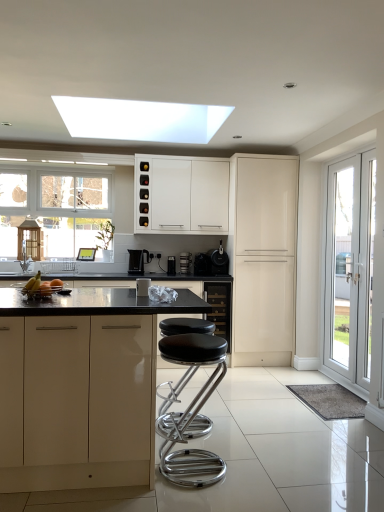
This screenshot has width=384, height=512. What do you see at coordinates (41, 286) in the screenshot? I see `yellow matte bananas at center` at bounding box center [41, 286].

This screenshot has width=384, height=512. Describe the element at coordinates (192, 412) in the screenshot. I see `polished chrome stool at center` at that location.

What do you see at coordinates (219, 308) in the screenshot?
I see `black matte wine cooler at center, marked as the third cabinetry in a back-to-front arrangement` at bounding box center [219, 308].

You are a GUI agent. You are given a task and a screenshot of the screen. Output one action in this format:
    pyautogui.click(x=<x>, y=<y>)
    Task: Click on the black matte wine cooler at center, positioned as the second cabinetry in front-to-back order
    
    Given the screenshot: What is the action you would take?
    pyautogui.click(x=219, y=308)

The image size is (384, 512). What are the coordinates of `white glossy cabinet at upper center, the first cabinetry in the back-to-front sequence` in the screenshot? It's located at (181, 195).

Describe the element at coordinates (138, 261) in the screenshot. I see `black plastic kettle at center` at that location.

In the scene shown: What is the approximate width of white glossy door at right, positioned as the 1th door in front-to-back order?

The width of white glossy door at right, positioned as the 1th door in front-to-back order, is 1.08 inches.

I want to click on yellow matte bananas at center, so click(x=41, y=286).

From a real-world perspective, is wooden door at left, the first door viewed from the back, positioned above or below matte cream cabinet at center, placed as the 1th cabinetry when sorted from front to back?

From a real-world perspective, wooden door at left, the first door viewed from the back, is physically above matte cream cabinet at center, placed as the 1th cabinetry when sorted from front to back.

Is wooden door at left, the 2th door viewed from the right, oriented away from matte cream cabinet at center, the 4th cabinetry in the back-to-front sequence?

No, matte cream cabinet at center, the 4th cabinetry in the back-to-front sequence, is not at the back of wooden door at left, the 2th door viewed from the right.

I want to click on the 3rd cabinetry positioned below the wooden door at left, the first door viewed from the back (from a real-world perspective), so click(x=81, y=405).

Is wooden door at left, the first door viewed from the back, completely or partially outside of matte cream cabinet at center, the 4th cabinetry in the back-to-front sequence?

wooden door at left, the first door viewed from the back, is positioned outside matte cream cabinet at center, the 4th cabinetry in the back-to-front sequence.

Considering the sizes of objects black matte coffee maker at center, which ranks as the fourth appliance in back-to-front order, and white glossy door at right, which is the second door in back-to-front order, in the image provided, who is bigger, black matte coffee maker at center, which ranks as the fourth appliance in back-to-front order, or white glossy door at right, which is the second door in back-to-front order,?

white glossy door at right, which is the second door in back-to-front order.

From the image's perspective, would you say black matte coffee maker at center, which is counted as the 2th appliance, starting from the front, is shown under white glossy door at right, positioned as the 1th door in front-to-back order?

No.

Relative to white glossy door at right, positioned as the 1th door in front-to-back order, is black matte coffee maker at center, the first appliance from the right, in front or behind?

In the image, black matte coffee maker at center, the first appliance from the right, appears behind white glossy door at right, positioned as the 1th door in front-to-back order.

Is black matte coffee maker at center, the first appliance from the right, not close to white glossy door at right, positioned as the 1th door in front-to-back order?

black matte coffee maker at center, the first appliance from the right, is far away from white glossy door at right, positioned as the 1th door in front-to-back order.

What are the coordinates of `door below the matte cream cabinet at center-right, which is the third cabinetry from front to back (from the image's perspective)` in the screenshot? It's located at coord(350,268).

Which of these two, white glossy door at right, which ranks as the 1th door in right-to-left order, or matte cream cabinet at center-right, which is the third cabinetry from front to back, stands taller?

With more height is matte cream cabinet at center-right, which is the third cabinetry from front to back.

In the scene shown: Is white glossy door at right, positioned as the 1th door in front-to-back order, completely or partially outside of matte cream cabinet at center-right, which is the third cabinetry from front to back?

white glossy door at right, positioned as the 1th door in front-to-back order, is positioned outside matte cream cabinet at center-right, which is the third cabinetry from front to back.

Considering the positions of objects black matte coffee maker at center, which ranks as the fourth appliance in back-to-front order, and black matte wine cooler at center, positioned as the second cabinetry in front-to-back order, in the image provided, who is more to the left, black matte coffee maker at center, which ranks as the fourth appliance in back-to-front order, or black matte wine cooler at center, positioned as the second cabinetry in front-to-back order,?

Positioned to the left is black matte wine cooler at center, positioned as the second cabinetry in front-to-back order.

From the image's perspective, is black matte coffee maker at center, the first appliance from the right, beneath black matte wine cooler at center, positioned as the second cabinetry in front-to-back order?

Actually, black matte coffee maker at center, the first appliance from the right, appears above black matte wine cooler at center, positioned as the second cabinetry in front-to-back order, in the image.

Are metallic silver coffee machine at center, which ranks as the 1th appliance in left-to-right order, and satin black coffee machine at center, the third appliance from the back, far apart?

Yes, metallic silver coffee machine at center, which ranks as the 1th appliance in left-to-right order, and satin black coffee machine at center, the third appliance from the back, are quite far apart.

From the image's perspective, does metallic silver coffee machine at center, which ranks as the 1th appliance in left-to-right order, appear lower than satin black coffee machine at center, the third appliance positioned from the front?

Correct, metallic silver coffee machine at center, which ranks as the 1th appliance in left-to-right order, appears lower than satin black coffee machine at center, the third appliance positioned from the front, in the image.

Do you think metallic silver coffee machine at center, acting as the 1th appliance starting from the front, is within satin black coffee machine at center, the third appliance from the back, or outside of it?

metallic silver coffee machine at center, acting as the 1th appliance starting from the front, is outside satin black coffee machine at center, the third appliance from the back.

In terms of size, does metallic silver coffee machine at center, which ranks as the 1th appliance in left-to-right order, appear bigger or smaller than satin black coffee machine at center, acting as the 4th appliance starting from the left?

In the image, metallic silver coffee machine at center, which ranks as the 1th appliance in left-to-right order, appears to be smaller than satin black coffee machine at center, acting as the 4th appliance starting from the left.

Considering the relative positions of matte cream cabinet at center, the 4th cabinetry in the back-to-front sequence, and black matte coffee maker at center, which ranks as the fourth appliance in back-to-front order, in the image provided, is matte cream cabinet at center, the 4th cabinetry in the back-to-front sequence, to the left of black matte coffee maker at center, which ranks as the fourth appliance in back-to-front order, from the viewer's perspective?

Yes, matte cream cabinet at center, the 4th cabinetry in the back-to-front sequence, is to the left of black matte coffee maker at center, which ranks as the fourth appliance in back-to-front order.

From the picture: From the image's perspective, is matte cream cabinet at center, the 4th cabinetry in the back-to-front sequence, positioned above or below black matte coffee maker at center, which is counted as the 2th appliance, starting from the front?

Clearly, from the image's perspective, matte cream cabinet at center, the 4th cabinetry in the back-to-front sequence, is below black matte coffee maker at center, which is counted as the 2th appliance, starting from the front.

Who is smaller, matte cream cabinet at center, the 4th cabinetry in the back-to-front sequence, or black matte coffee maker at center, which ranks as the fourth appliance in back-to-front order?

With smaller size is black matte coffee maker at center, which ranks as the fourth appliance in back-to-front order.

You are a GUI agent. You are given a task and a screenshot of the screen. Output one action in this format:
    pyautogui.click(x=<x>, y=<y>)
    Task: Click on the 5th appliance positioned above the matte cream cabinet at center, the 4th cabinetry in the back-to-front sequence (from the image's perspective)
    The image size is (384, 512).
    Given the screenshot: What is the action you would take?
    pyautogui.click(x=211, y=263)

Can you confirm if white glossy door at right, which ranks as the 1th door in right-to-left order, is smaller than satin black toaster at center, which is the 5th appliance in front-to-back order?

No, white glossy door at right, which ranks as the 1th door in right-to-left order, is not smaller than satin black toaster at center, which is the 5th appliance in front-to-back order.

Could you tell me if white glossy door at right, positioned as the 1th door in front-to-back order, is turned towards satin black toaster at center, the 1th appliance from the back?

No, white glossy door at right, positioned as the 1th door in front-to-back order, is not oriented towards satin black toaster at center, the 1th appliance from the back.

Is white glossy door at right, which is the second door in back-to-front order, completely or partially outside of satin black toaster at center, the 1th appliance from the back?

Yes, white glossy door at right, which is the second door in back-to-front order, is not within satin black toaster at center, the 1th appliance from the back.

There is a matte cream cabinet at center, placed as the 1th cabinetry when sorted from front to back. Where is `the 2nd door above it (from a real-world perspective)`? the 2nd door above it (from a real-world perspective) is located at coordinates (29, 242).

The height and width of the screenshot is (512, 384). I want to click on door on the right of black matte coffee maker at center, which ranks as the fourth appliance in back-to-front order, so click(350, 268).

Based on their spatial positions, is matte cream cabinet at center-right, which is the third cabinetry from front to back, or polished chrome stool at center closer to wooden door at left, the 2th door viewed from the right?

Based on the image, matte cream cabinet at center-right, which is the third cabinetry from front to back, appears to be nearer to wooden door at left, the 2th door viewed from the right.

Consider the image. Looking at the image, which one is located closer to matte cream cabinet at center, placed as the 1th cabinetry when sorted from front to back, satin black coffee machine at center, the 2th appliance in the right-to-left sequence, or matte cream cabinet at center-right, which is the third cabinetry from front to back?

Based on the image, matte cream cabinet at center-right, which is the third cabinetry from front to back, appears to be nearer to matte cream cabinet at center, placed as the 1th cabinetry when sorted from front to back.

From the image, which object appears to be nearer to white glossy door at right, which is the second door in back-to-front order, black matte wine cooler at center, positioned as the second cabinetry in front-to-back order, or black plastic coffee maker at center, the second appliance when ordered from left to right?

The object closer to white glossy door at right, which is the second door in back-to-front order, is black matte wine cooler at center, positioned as the second cabinetry in front-to-back order.

From the image, which object appears to be nearer to black plastic kettle at center, wooden door at left, the 2th door viewed from the right, or matte cream cabinet at center, the 4th cabinetry in the back-to-front sequence?

wooden door at left, the 2th door viewed from the right, lies closer to black plastic kettle at center than the other object.

Based on their spatial positions, is satin black toaster at center, which is counted as the 3th appliance, starting from the left, or white glossy door at right, which is the second door in back-to-front order, further from polished chrome stool at center?

Based on the image, satin black toaster at center, which is counted as the 3th appliance, starting from the left, appears to be further to polished chrome stool at center.

Estimate the real-world distances between objects in this image. Which object is further from satin black toaster at center, the 1th appliance from the back, matte cream cabinet at center-right, which is counted as the second cabinetry, starting from the back, or matte cream cabinet at center, the 4th cabinetry in the back-to-front sequence?

Among the two, matte cream cabinet at center, the 4th cabinetry in the back-to-front sequence, is located further to satin black toaster at center, the 1th appliance from the back.

Which object lies nearer to the anchor point wooden door at left, the 2th door viewed from the right, matte cream cabinet at center, placed as the 1th cabinetry when sorted from front to back, or white glossy door at right, positioned as the 2th door in left-to-right order?

The object closer to wooden door at left, the 2th door viewed from the right, is matte cream cabinet at center, placed as the 1th cabinetry when sorted from front to back.

When comparing their distances from black matte coffee maker at center, which is counted as the 2th appliance, starting from the front, does satin black toaster at center, which is counted as the 3th appliance, starting from the left, or yellow matte bananas at center seem further?

yellow matte bananas at center lies further to black matte coffee maker at center, which is counted as the 2th appliance, starting from the front, than the other object.

You are a GUI agent. You are given a task and a screenshot of the screen. Output one action in this format:
    pyautogui.click(x=<x>, y=<y>)
    Task: Click on the fruit between matte cream cabinet at center, placed as the 1th cabinetry when sorted from front to back, and wooden door at left, the first door viewed from the back, from front to back
    The height and width of the screenshot is (512, 384).
    Given the screenshot: What is the action you would take?
    pyautogui.click(x=41, y=286)

Where is `kitchen appliance positioned between yellow matte bananas at center and black plastic coffee maker at center, which is counted as the second appliance, starting from the back, from near to far`? This screenshot has width=384, height=512. kitchen appliance positioned between yellow matte bananas at center and black plastic coffee maker at center, which is counted as the second appliance, starting from the back, from near to far is located at coordinates (138, 261).

You are a GUI agent. You are given a task and a screenshot of the screen. Output one action in this format:
    pyautogui.click(x=<x>, y=<y>)
    Task: Click on the kitchen appliance between polished chrome stool at center and wooden door at left, the first door viewed from the back, from front to back
    The height and width of the screenshot is (512, 384).
    Given the screenshot: What is the action you would take?
    pyautogui.click(x=138, y=261)

Where is `fruit between matte cream cabinet at center, the 4th cabinetry in the back-to-front sequence, and satin black coffee machine at center, the third appliance from the back, along the z-axis`? The width and height of the screenshot is (384, 512). fruit between matte cream cabinet at center, the 4th cabinetry in the back-to-front sequence, and satin black coffee machine at center, the third appliance from the back, along the z-axis is located at coordinates (41, 286).